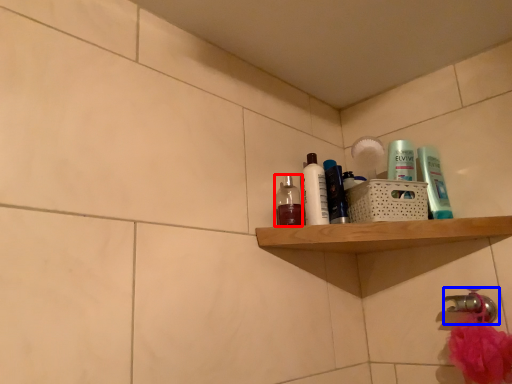
Question: Which object is closer to the camera taking this photo, toiletry (highlighted by a red box) or tap (highlighted by a blue box)?

Choices:
 (A) toiletry
 (B) tap

Answer: (B)